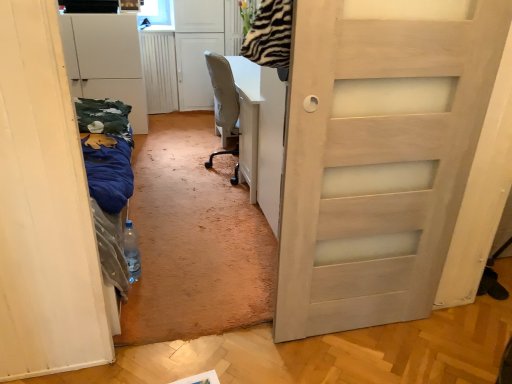
Consider the image. In order to face translucent plastic bottle at center, should I rotate leftwards or rightwards?

A 15.866 degree turn to the left will do.

This screenshot has height=384, width=512. I want to click on translucent plastic bottle at center, so click(132, 252).

Measure the distance between white matte cabinet at left and camera.

A distance of 3.28 meters exists between white matte cabinet at left and camera.

In order to face white matte door at left, should I rotate leftwards or rightwards?

You should rotate left by 23.117 degrees.

Identify the location of white matte door at left. (44, 208).

The height and width of the screenshot is (384, 512). Find the location of `translucent plastic bottle at center`. translucent plastic bottle at center is located at coordinates (132, 252).

From the image's perspective, which is below, white matte cabinet at left or white matte door at left?

white matte door at left.

Is point (118, 65) more distant than point (25, 199)?

Yes, point (118, 65) is behind point (25, 199).

Looking at this image, considering the sizes of objects white matte cabinet at left and white matte door at left in the image provided, who is wider, white matte cabinet at left or white matte door at left?

With larger width is white matte door at left.

Can you tell me how much white matte cabinet at left and white matte door at left differ in facing direction?

91.1 degrees.

Is translucent plastic bottle at center looking in the opposite direction of white matte cabinet at left?

translucent plastic bottle at center does not have its back to white matte cabinet at left.

Can you confirm if translucent plastic bottle at center is positioned to the left of white matte cabinet at left?

No, translucent plastic bottle at center is not to the left of white matte cabinet at left.

Consider the image. Is translucent plastic bottle at center closer to the viewer compared to white matte cabinet at left?

Yes.

Is translucent plastic bottle at center wider or thinner than white matte cabinet at left?

Considering their sizes, translucent plastic bottle at center looks slimmer than white matte cabinet at left.

Does white matte cabinet at left turn towards translucent plastic bottle at center?

Yes, white matte cabinet at left is facing translucent plastic bottle at center.

Would you consider white matte cabinet at left to be distant from translucent plastic bottle at center?

Indeed, white matte cabinet at left is not near translucent plastic bottle at center.

From a real-world perspective, relative to translucent plastic bottle at center, is white matte cabinet at left vertically above or below?

In terms of real-world spatial position, white matte cabinet at left is above translucent plastic bottle at center.

From the image's perspective, would you say white matte cabinet at left is positioned over translucent plastic bottle at center?

Correct, white matte cabinet at left appears higher than translucent plastic bottle at center in the image.

Would you consider white matte door at left to be distant from white matte cabinet at left?

Yes, white matte door at left and white matte cabinet at left are located far from each other.

Between point (36, 191) and point (134, 113), which one is positioned behind?

The point (134, 113) is farther.

From a real-world perspective, is white matte door at left below white matte cabinet at left?

Indeed, from a real-world perspective, white matte door at left is positioned beneath white matte cabinet at left.

Considering the sizes of white matte door at left and white matte cabinet at left in the image, is white matte door at left wider or thinner than white matte cabinet at left?

Considering their sizes, white matte door at left looks broader than white matte cabinet at left.

Between point (124, 234) and point (21, 60), which one is positioned in front?

Point (21, 60)

From the image's perspective, relative to white matte door at left, is translucent plastic bottle at center above or below?

Based on their image positions, translucent plastic bottle at center is located beneath white matte door at left.

Between translucent plastic bottle at center and white matte door at left, which one has smaller size?

translucent plastic bottle at center is smaller.

Is white matte door at left further to camera compared to translucent plastic bottle at center?

No, it is not.

Considering the sizes of white matte door at left and translucent plastic bottle at center in the image, is white matte door at left bigger or smaller than translucent plastic bottle at center?

Clearly, white matte door at left is larger in size than translucent plastic bottle at center.

Is white matte door at left in contact with translucent plastic bottle at center?

No.

In the scene shown: Does white matte door at left contain translucent plastic bottle at center?

Yes, white matte door at left contains translucent plastic bottle at center.

You are a GUI agent. You are given a task and a screenshot of the screen. Output one action in this format:
    pyautogui.click(x=<x>, y=<y>)
    Task: Click on the cabinetry behind the white matte door at left
    This screenshot has height=384, width=512.
    Given the screenshot: What is the action you would take?
    [106, 61]

Image resolution: width=512 pixels, height=384 pixels. I want to click on cabinetry that appears above the translucent plastic bottle at center (from a real-world perspective), so click(106, 61).

From the image, which object appears to be farther from white matte cabinet at left, translucent plastic bottle at center or white matte door at left?

white matte door at left lies further to white matte cabinet at left than the other object.

Based on their spatial positions, is translucent plastic bottle at center or white matte cabinet at left closer to white matte door at left?

translucent plastic bottle at center.

From the image, which object appears to be farther from translucent plastic bottle at center, white matte door at left or white matte cabinet at left?

Among the two, white matte cabinet at left is located further to translucent plastic bottle at center.

Consider the image. Based on their spatial positions, is white matte cabinet at left or white matte door at left further from translucent plastic bottle at center?

white matte cabinet at left is positioned further to the anchor translucent plastic bottle at center.

Considering their positions, is white matte door at left positioned further to white matte cabinet at left than translucent plastic bottle at center?

white matte door at left is positioned further to the anchor white matte cabinet at left.

Estimate the real-world distances between objects in this image. Which object is closer to white matte door at left, white matte cabinet at left or translucent plastic bottle at center?

Among the two, translucent plastic bottle at center is located nearer to white matte door at left.

Image resolution: width=512 pixels, height=384 pixels. I want to click on bottle positioned between white matte door at left and white matte cabinet at left from near to far, so click(x=132, y=252).